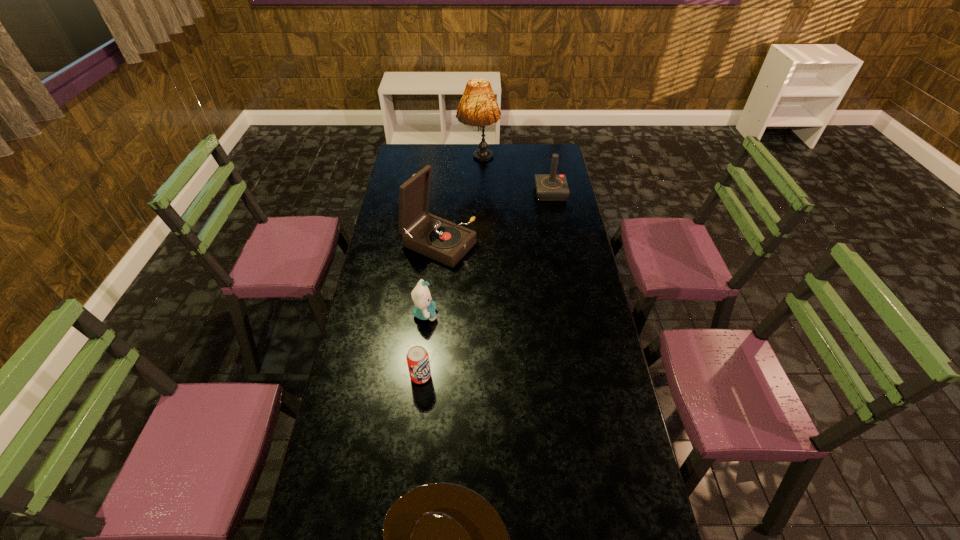
Locate which object ranks second in proximity to the second nearest object. Please provide its 2D coordinates. Your answer should be formatted as a tuple, i.e. [(x, y)], where the tuple contains the x and y coordinates of a point satisfying the conditions above.

[(440, 539)]

What are the coordinates of `vacant space that satisfies the following two spatial constraints: 1. on the face of the kitten; 2. on the left side of the soda can` in the screenshot? It's located at (419, 376).

Where is `vacant point that satisfies the following two spatial constraints: 1. on the face of the fourth farthest object; 2. on the back side of the second nearest object`? The height and width of the screenshot is (540, 960). vacant point that satisfies the following two spatial constraints: 1. on the face of the fourth farthest object; 2. on the back side of the second nearest object is located at coordinates (419, 376).

Locate an element on the screen. This screenshot has height=540, width=960. free space that satisfies the following two spatial constraints: 1. on the face of the third nearest object; 2. on the left side of the fifth farthest object is located at coordinates (419, 376).